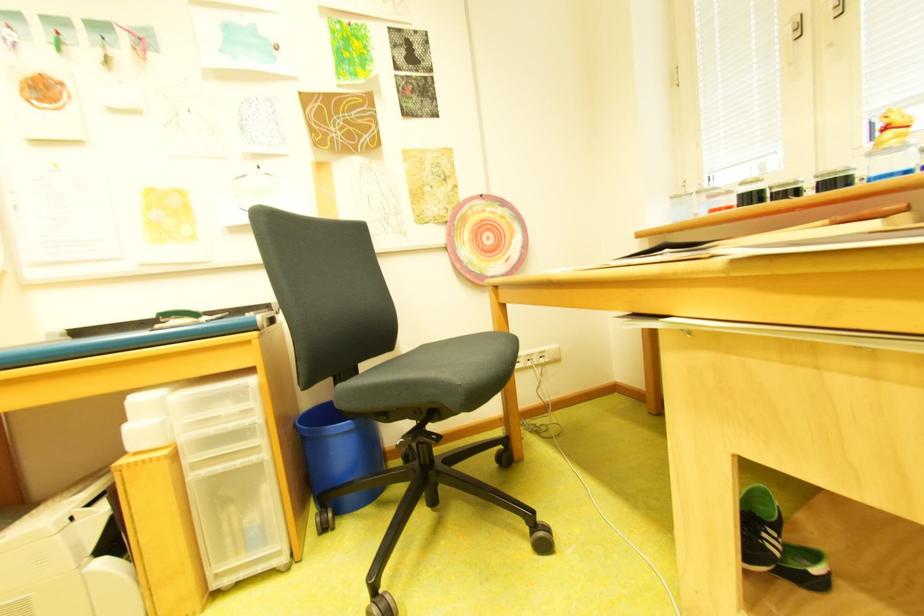
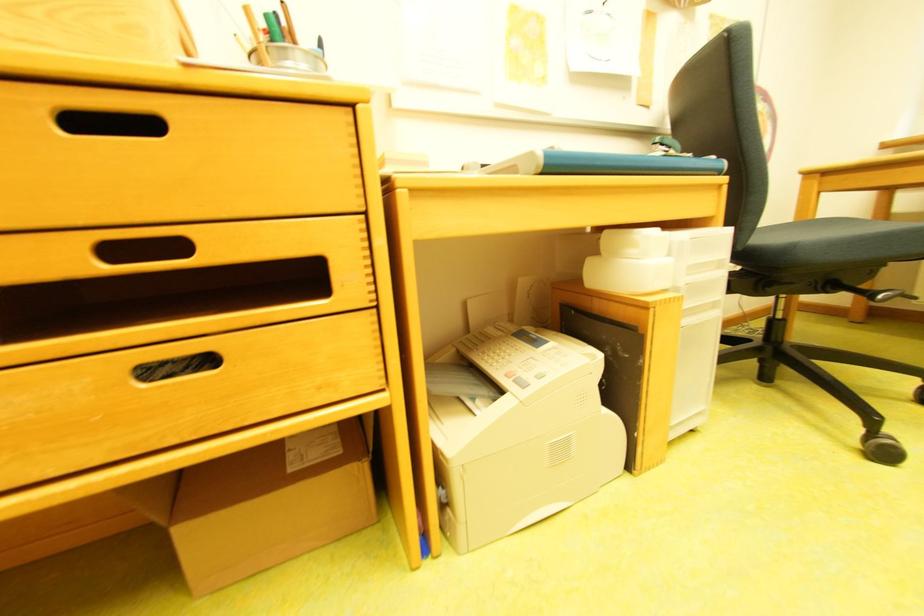
Question: Which direction would the cameraman need to move to produce the second image? Reply with the corresponding letter.

Choices:
 (A) Left
 (B) Right
 (C) Forward
 (D) Backward

Answer: (A)